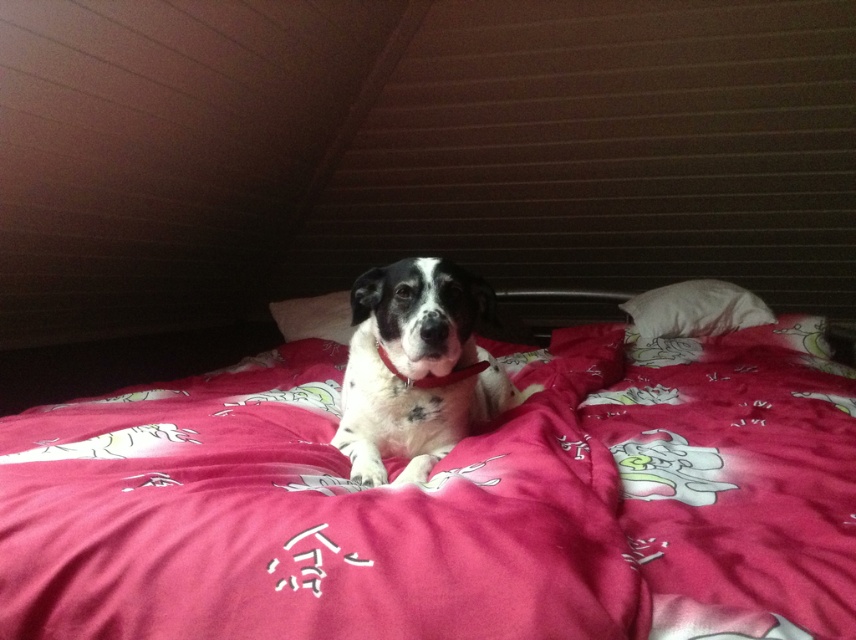
Question: Does pink fabric bed at center have a greater width compared to white soft pillow at upper center?

Choices:
 (A) yes
 (B) no

Answer: (A)

Question: Which object is closer to the camera taking this photo?

Choices:
 (A) white-spotted fur dog at center
 (B) pink fabric bed at center
 (C) white soft pillow at upper center
 (D) white soft pillow at center

Answer: (B)

Question: Which point appears closest to the camera in this image?

Choices:
 (A) (459, 349)
 (B) (293, 328)
 (C) (706, 320)
 (D) (823, 388)

Answer: (A)

Question: Among these objects, which one is farthest from the camera?

Choices:
 (A) white-spotted fur dog at center
 (B) white soft pillow at center

Answer: (B)

Question: Can you confirm if pink fabric bed at center is smaller than white-spotted fur dog at center?

Choices:
 (A) yes
 (B) no

Answer: (B)

Question: Can you confirm if white-spotted fur dog at center is thinner than white soft pillow at center?

Choices:
 (A) yes
 (B) no

Answer: (B)